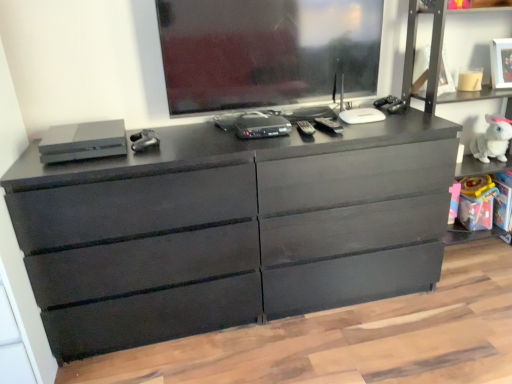
This screenshot has height=384, width=512. I want to click on vacant point to the right of black plastic remote control at center, which ranks as the third equipment in left-to-right order, so click(x=362, y=123).